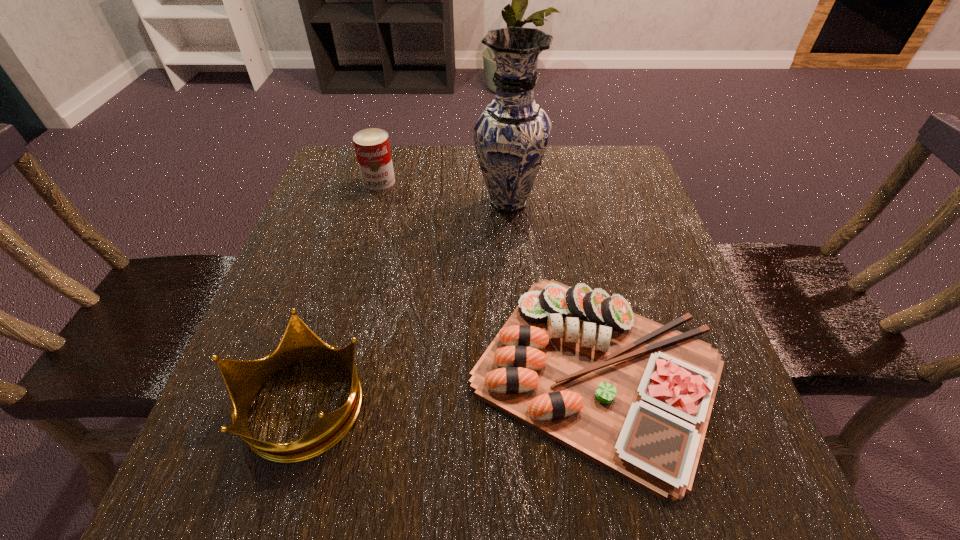
You are a GUI agent. You are given a task and a screenshot of the screen. Output one action in this format:
    pyautogui.click(x=<x>, y=<y>)
    Task: Click on the tallest object
    
    Given the screenshot: What is the action you would take?
    pyautogui.click(x=511, y=135)

The image size is (960, 540). I want to click on can, so click(x=372, y=147).

Identify the location of crown. (244, 378).

At what (x,y) coordinates should I click in order to perform the action: click on the shortest object. Please return your answer as a coordinate pair (x, y). The width and height of the screenshot is (960, 540). Looking at the image, I should click on (580, 366).

In order to click on free spot located on the right of the tallest object in this screenshot , I will do `click(574, 202)`.

This screenshot has height=540, width=960. In order to click on vacant space located on the front label of the can in this screenshot , I will do `click(346, 301)`.

Find the location of a particular element. Image resolution: width=960 pixels, height=540 pixels. vacant space located 0.060m on the front of the crown is located at coordinates (268, 515).

At what (x,y) coordinates should I click in order to perform the action: click on blank space located on the left of the shortest object. Please return your answer as a coordinate pair (x, y). Looking at the image, I should click on [290, 372].

I want to click on vase present at the far edge, so click(x=511, y=135).

The width and height of the screenshot is (960, 540). What are the coordinates of `can that is at the far edge` in the screenshot? It's located at (372, 147).